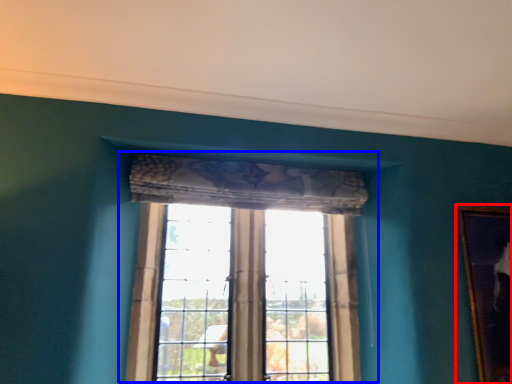
Question: Which object is further to the camera taking this photo, picture frame (highlighted by a red box) or window (highlighted by a blue box)?

Choices:
 (A) picture frame
 (B) window

Answer: (A)